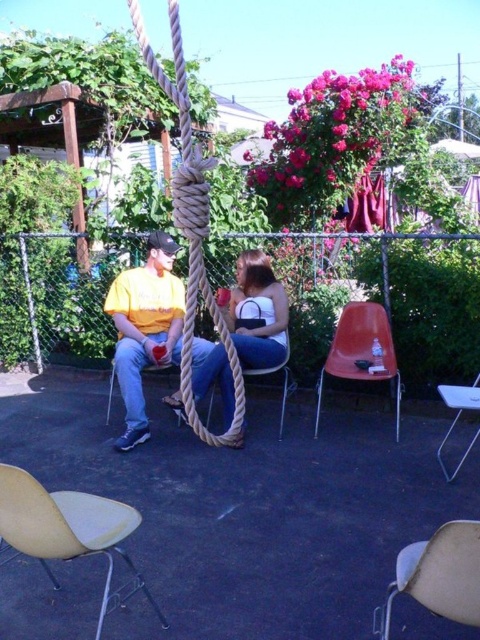
In the scene shown: You are organizing a picnic and need to place your matte white purse at center and white plastic chair at lower right. Based on their positions, which item is closer to the fence?

The matte white purse at center is closer to the fence because it is positioned to the left of the white plastic chair at lower right, and the swing is near the chain link fence.

You are standing in the backyard and want to place a small garden statue between the two points marked as point (257, 284) and point (468, 387). Which point should the statue be closer to in order to be more visible from where you are standing?

The statue should be placed closer to point (257, 284) because it is closer to the viewer, making it more visible from where you are standing.

You are planning to place a small table between the matte white purse at center and the white plastic chair at lower right. The table requires 5 feet of space. Based on the scene, will there be enough space for the table?

The matte white purse at center is 4.24 feet from the white plastic chair at lower right. Since the required space for the table is 5 feet, there isn not enough space between them to place the table.